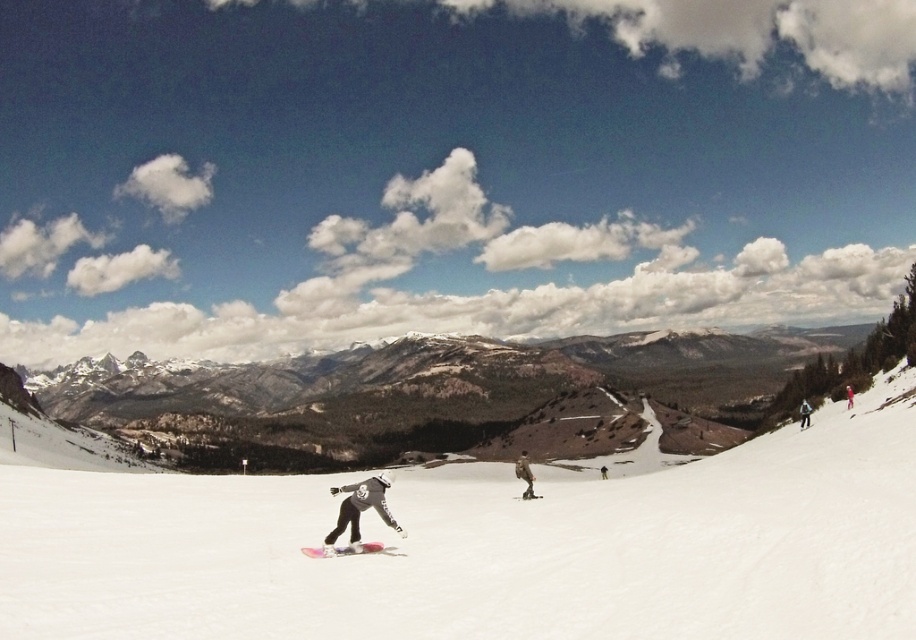
You are a photographer capturing this winter scene. You notice the matte black snowboarder at center and the camouflage fabric jacket at center. Which object appears larger in the photo?

The camouflage fabric jacket at center appears larger because it is taller than the matte black snowboarder at center.

You are a photographer positioned at the top of the slope. You want to capture a photo that includes both the matte black snowboarder at center and the matte pink snowboard at right. Based on their positions, which object will appear closer to the camera in the photo?

The matte black snowboarder at center will appear closer to the camera because they are positioned in front of the matte pink snowboard at right.

You are a photographer planning to capture a photo of the matte black snowboarder at center and the matte pink snowboard at right. Based on their sizes in the image, which object should you focus on first to ensure both are in frame?

The matte black snowboarder at center is smaller than the matte pink snowboard at right. To ensure both are in frame, focus on the matte pink snowboard at right first since it is larger and will require more space.